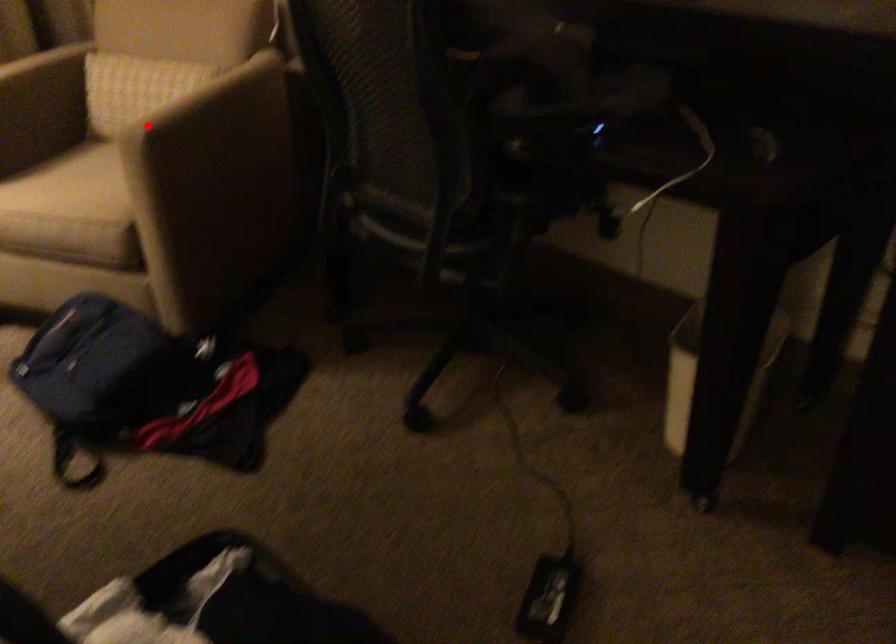
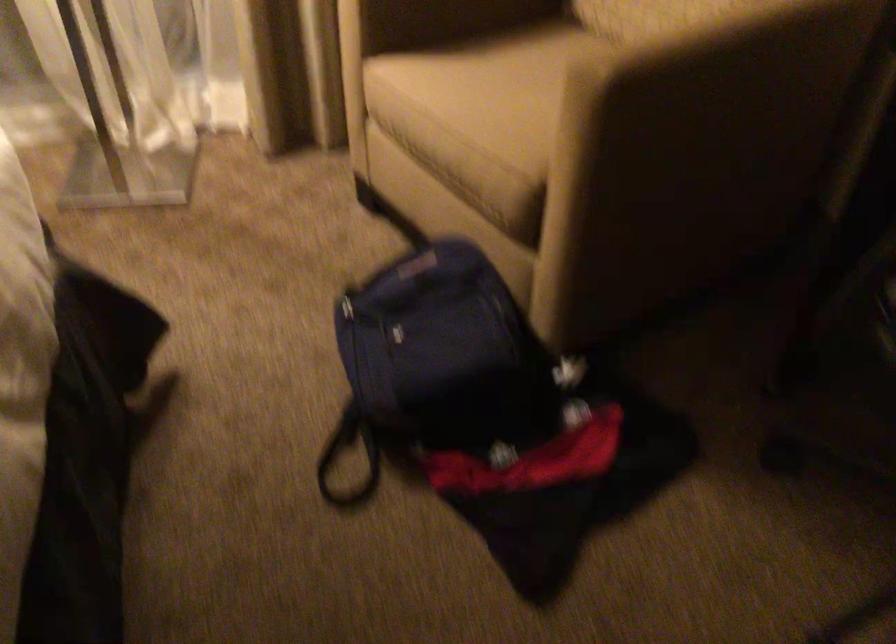
Question: I am providing you with two images of the same scene from different viewpoints. A red point is shown in image1. For the corresponding object point in image2, is it positioned nearer or farther from the camera?

Choices:
 (A) Nearer
 (B) Farther

Answer: (A)